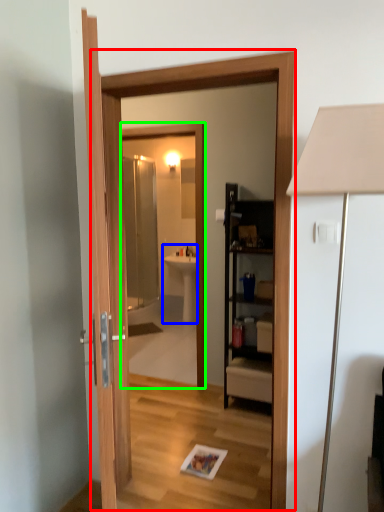
Question: Which is farther away from screen door (highlighted by a red box)? sink (highlighted by a blue box) or mirror (highlighted by a green box)?

Choices:
 (A) sink
 (B) mirror

Answer: (A)